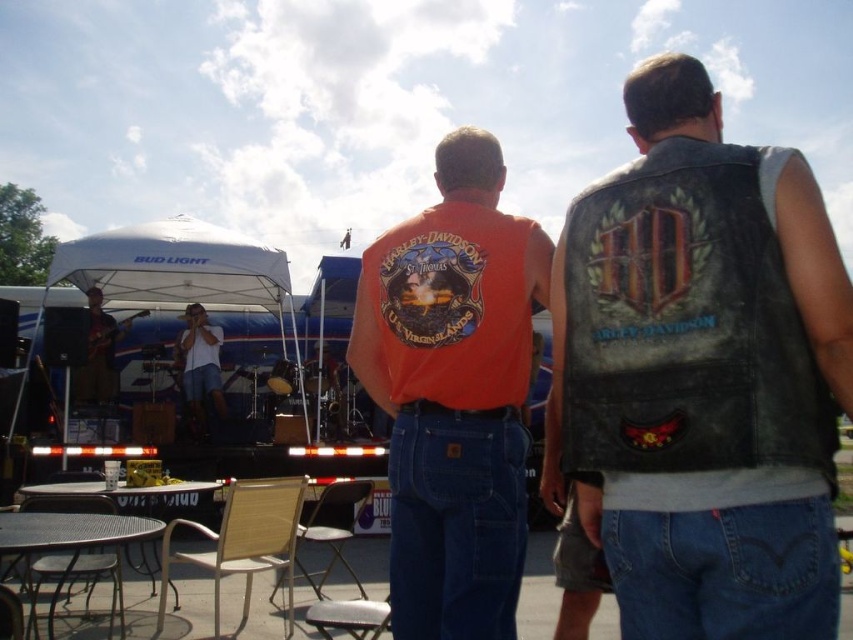
Does point (701, 460) come closer to viewer compared to point (213, 352)?

Yes.

Who is more distant from viewer, (822, 280) or (202, 388)?

Positioned behind is point (202, 388).

Locate an element on the screen. The width and height of the screenshot is (853, 640). leather vest at center is located at coordinates (701, 374).

Which is more to the left, orange cotton t-shirt at center or matte black guitar at left?

Positioned to the left is matte black guitar at left.

Is orange cotton t-shirt at center positioned before matte black guitar at left?

Yes, orange cotton t-shirt at center is closer to the viewer.

Is point (438, 188) closer to camera compared to point (128, 317)?

Yes, point (438, 188) is closer to viewer.

Locate an element on the screen. orange cotton t-shirt at center is located at coordinates 453,392.

This screenshot has width=853, height=640. Describe the element at coordinates (173, 266) in the screenshot. I see `white fabric canopy at upper left` at that location.

Who is more distant from viewer, (204, 300) or (341, 488)?

Positioned behind is point (204, 300).

Between point (244, 248) and point (361, 596), which one is positioned behind?

The point (244, 248) is more distant.

What are the coordinates of `white fabric canopy at upper left` in the screenshot? It's located at (173, 266).